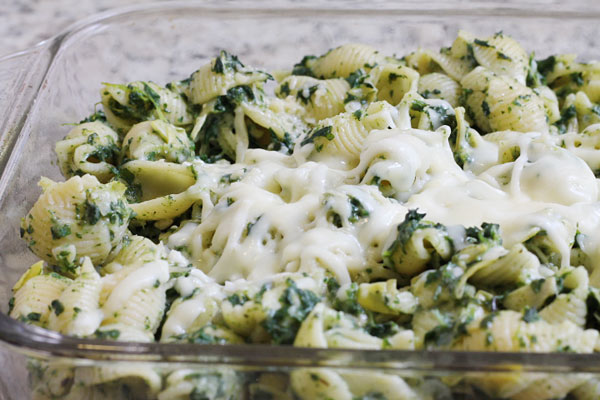
Identify the location of glass. (130, 373).